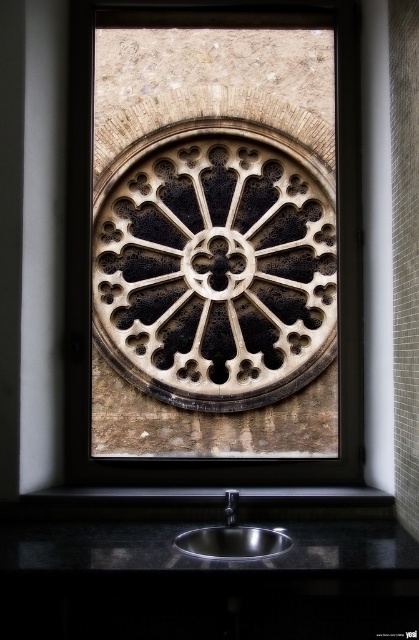
You are a plumber inspecting a kitchen sink setup. You need to determine if the black metallic faucet at lower center can fit into the polished stainless steel sink at lower center. Based on their sizes, what is your assessment?

The polished stainless steel sink at lower center is larger in size than the black metallic faucet at lower center, so the faucet can fit into the sink as it is smaller in size.

You are a window cleaner who needs to clean both the black stone rose window at center and the polished stainless steel sink at lower center. You have a ladder that can reach up to 3 meters. Can you safely clean both objects without moving the ladder?

The black stone rose window at center and the polished stainless steel sink at lower center are 2.92 meters apart from each other. Since the ladder can reach up to 3 meters, you can safely clean both objects without moving the ladder as the distance between them is within the ladder reach.